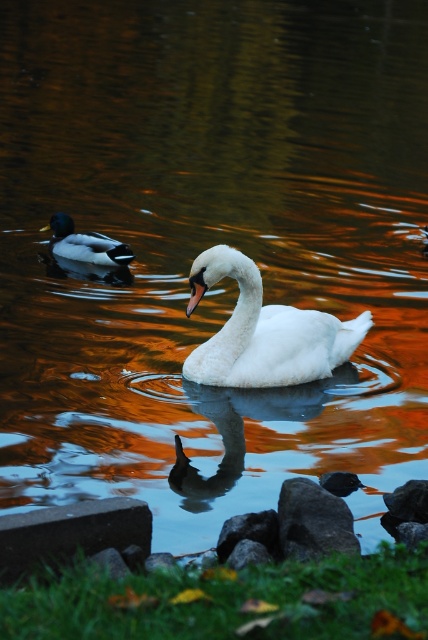
Question: Is white matte swan at center further to the viewer compared to green glossy duck at left?

Choices:
 (A) yes
 (B) no

Answer: (B)

Question: Considering the real-world distances, which object is farthest from the white matte swan at center?

Choices:
 (A) green glossy duck at left
 (B) smooth gray rock at lower center

Answer: (A)

Question: Does white matte swan at center have a lesser width compared to smooth gray rock at lower center?

Choices:
 (A) yes
 (B) no

Answer: (B)

Question: Which of the following is the farthest from the observer?

Choices:
 (A) (83, 256)
 (B) (17, 513)

Answer: (A)

Question: Can you confirm if white matte swan at center is thinner than gray concrete at lower left?

Choices:
 (A) yes
 (B) no

Answer: (B)

Question: Which point is closer to the camera taking this photo?

Choices:
 (A) (285, 556)
 (B) (21, 538)

Answer: (B)